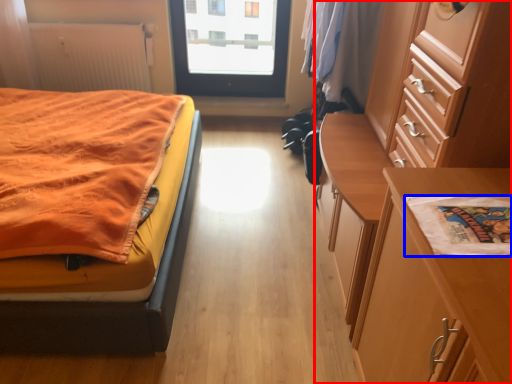
Question: Which object appears closest to the camera in this image, chest of drawers (highlighted by a red box) or linen (highlighted by a blue box)?

Choices:
 (A) chest of drawers
 (B) linen

Answer: (B)